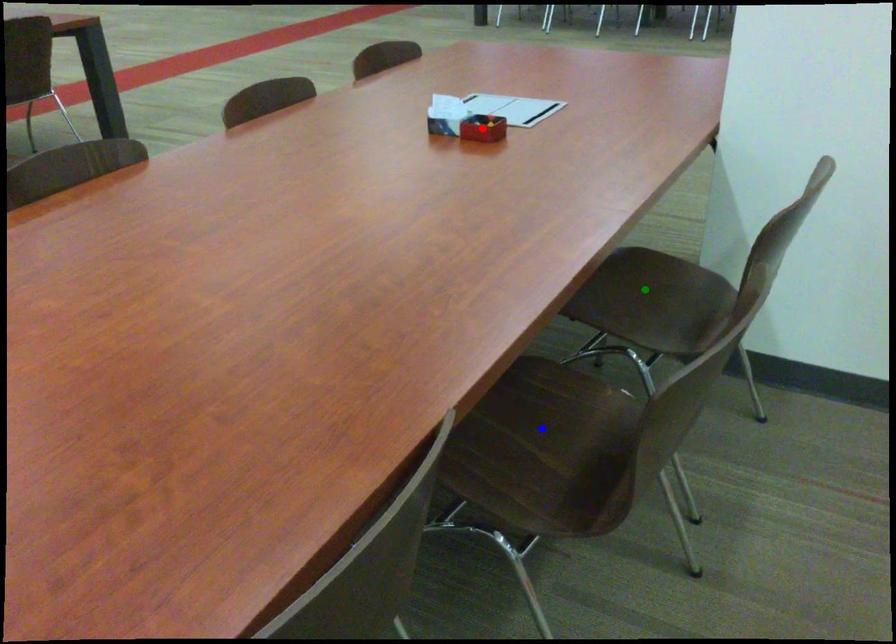
Order these from farthest to nearest:
green point, blue point, red point

red point < green point < blue point